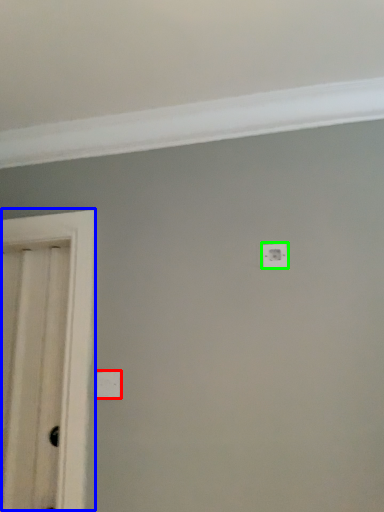
Question: Which object is positioned closest to light switch (highlighted by a red box)? Select from door (highlighted by a blue box) and light switch (highlighted by a green box).

Choices:
 (A) door
 (B) light switch

Answer: (A)